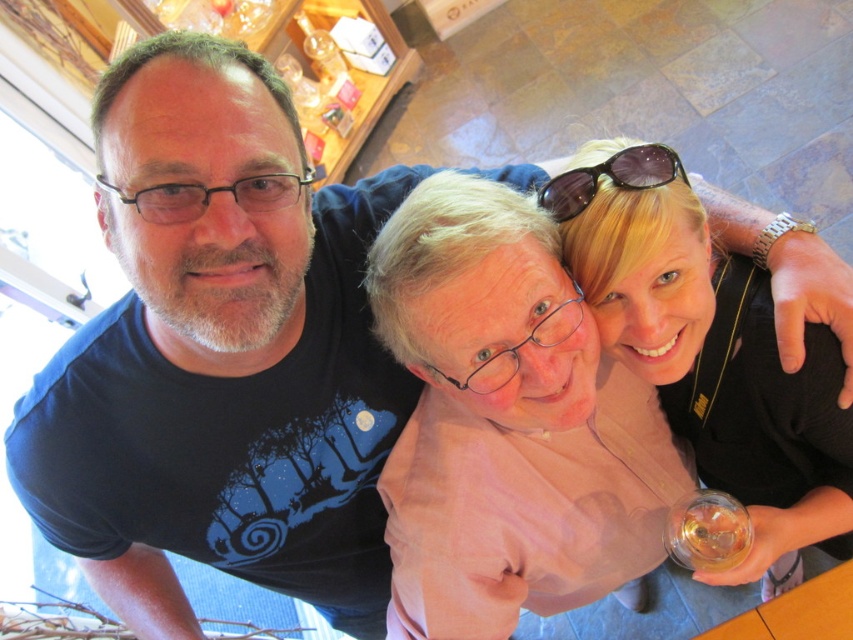
Is blonde hair at upper right below black plastic glasses at upper left?

Indeed, blonde hair at upper right is positioned under black plastic glasses at upper left.

Which is more to the right, blonde hair at upper right or black plastic glasses at upper left?

From the viewer's perspective, blonde hair at upper right appears more on the right side.

Is point (775, 454) positioned after point (183, 204)?

That is True.

I want to click on blonde hair at upper right, so click(711, 348).

In the scene shown: Can you confirm if black plastic glasses at upper left is shorter than black plastic sunglasses at upper center?

Yes, black plastic glasses at upper left is shorter than black plastic sunglasses at upper center.

Does black plastic glasses at upper left have a greater width compared to black plastic sunglasses at upper center?

Yes.

Where is `black plastic glasses at upper left`? This screenshot has width=853, height=640. black plastic glasses at upper left is located at coordinates (212, 193).

Who is more forward, (714, 429) or (622, 179)?

Point (622, 179) is in front.

You are a GUI agent. You are given a task and a screenshot of the screen. Output one action in this format:
    pyautogui.click(x=<x>, y=<y>)
    Task: Click on the blonde hair at upper right
    
    Given the screenshot: What is the action you would take?
    point(711,348)